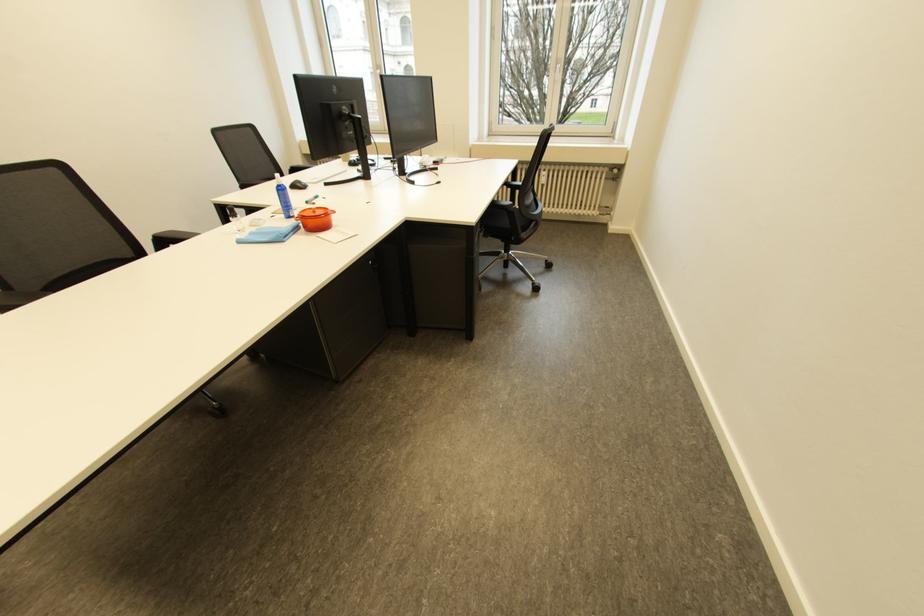
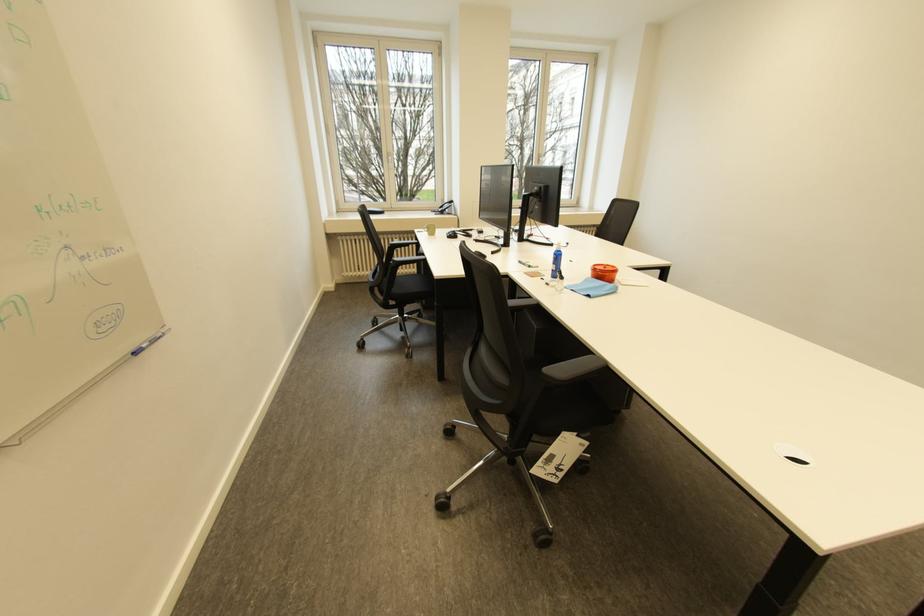
The point at (x=565, y=61) is marked in the first image. Where is the corresponding point in the second image?

(548, 156)